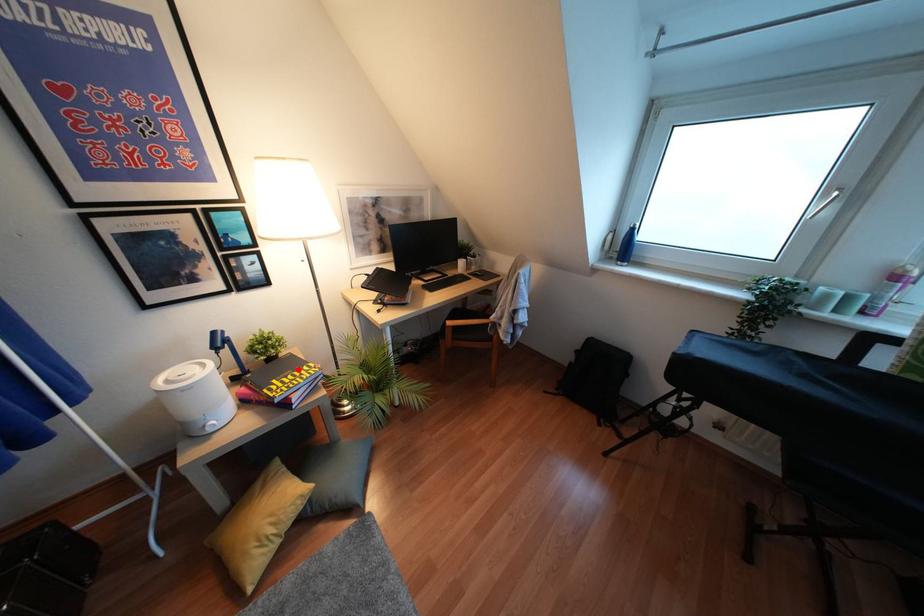
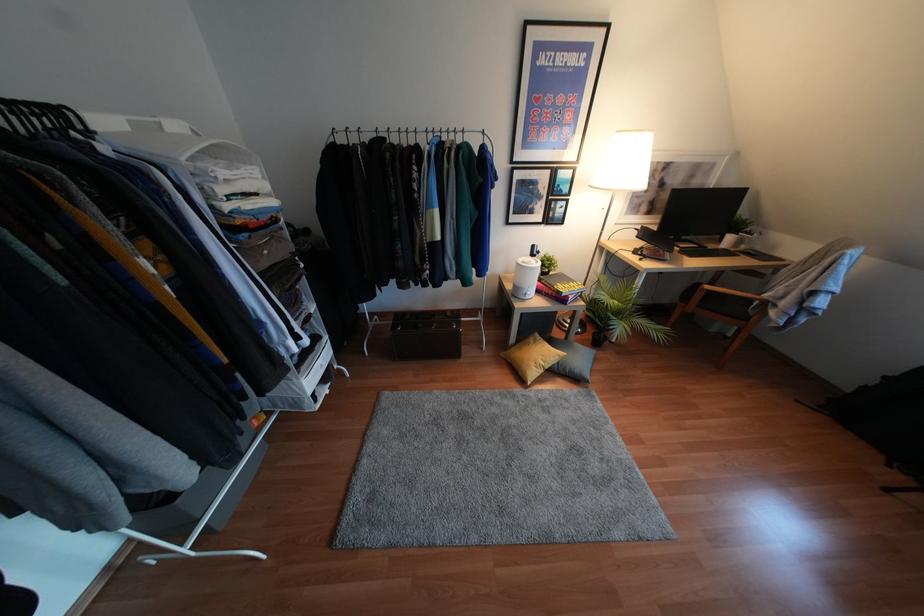
In the second image, find the point that corresponds to the highlighted location in the first image.

(570, 283)